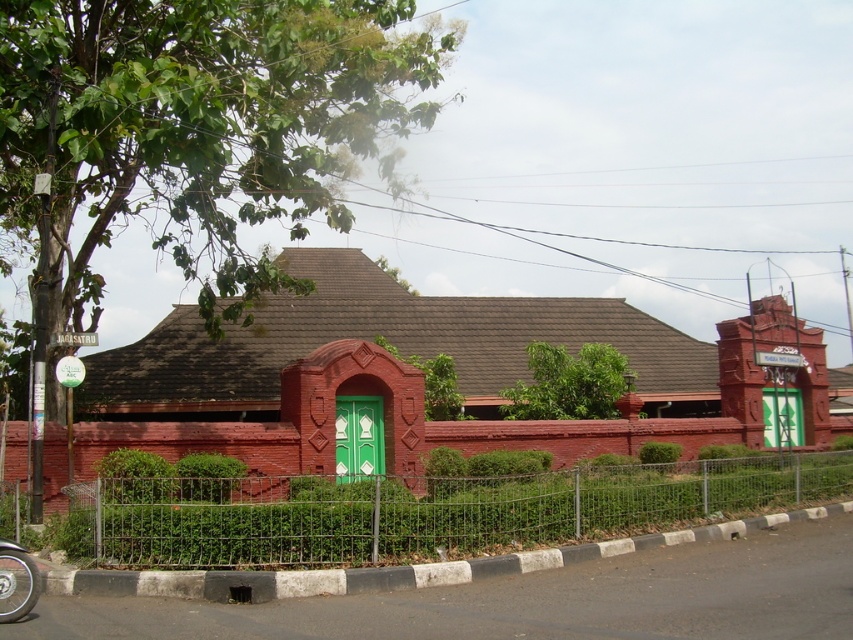
Question: Can you confirm if metal wire fence at lower center is thinner than shiny metallic wheel at lower left?

Choices:
 (A) yes
 (B) no

Answer: (B)

Question: Which point is closer to the camera?

Choices:
 (A) metal wire fence at lower center
 (B) shiny metallic wheel at lower left

Answer: (B)

Question: Can you confirm if metal wire fence at lower center is smaller than shiny metallic wheel at lower left?

Choices:
 (A) yes
 (B) no

Answer: (B)

Question: Is metal wire fence at lower center to the right of shiny metallic wheel at lower left from the viewer's perspective?

Choices:
 (A) no
 (B) yes

Answer: (B)